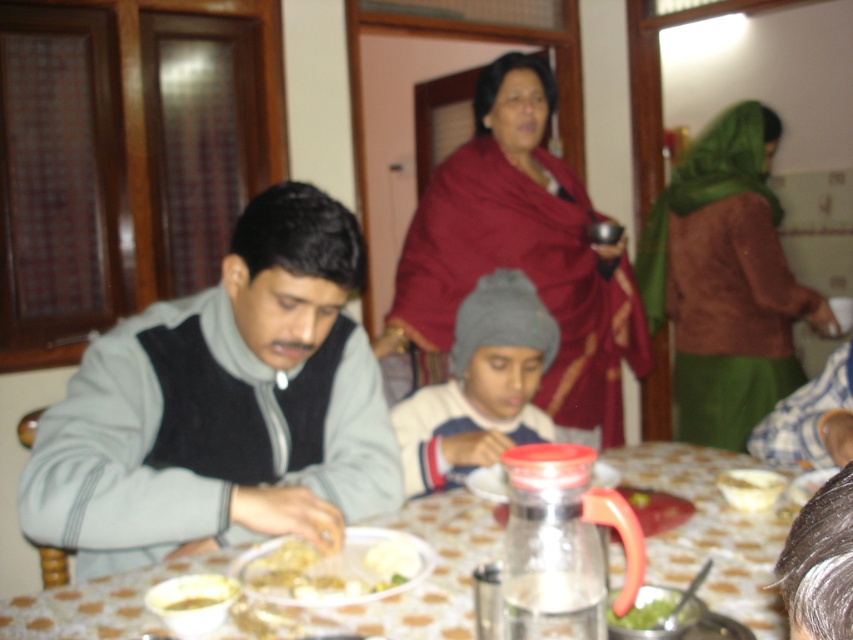
Who is positioned more to the right, gray knit hat at center or yellowish matte plate at lower left?

Positioned to the right is gray knit hat at center.

Between point (476, 308) and point (210, 589), which one is positioned behind?

Point (476, 308)

Identify the location of gray knit hat at center. (480, 387).

Between maroon fabric shawl at center and brown textured robe at upper right, which one has less height?

Standing shorter between the two is maroon fabric shawl at center.

Between point (531, 120) and point (669, 310), which one is positioned in front?

Point (531, 120) is more forward.

Is point (445, 211) positioned in front of point (672, 374)?

Yes, it is in front of point (672, 374).

You are a GUI agent. You are given a task and a screenshot of the screen. Output one action in this format:
    pyautogui.click(x=<x>, y=<y>)
    Task: Click on the maroon fabric shawl at center
    
    Given the screenshot: What is the action you would take?
    pyautogui.click(x=521, y=252)

Is point (219, 365) closer to viewer compared to point (399, 547)?

No.

Is gray fleece jacket at center behind white creamy rice at lower center?

That is True.

Is point (93, 442) behind point (386, 557)?

Yes, it is.

The height and width of the screenshot is (640, 853). In order to click on gray fleece jacket at center in this screenshot , I will do `click(223, 404)`.